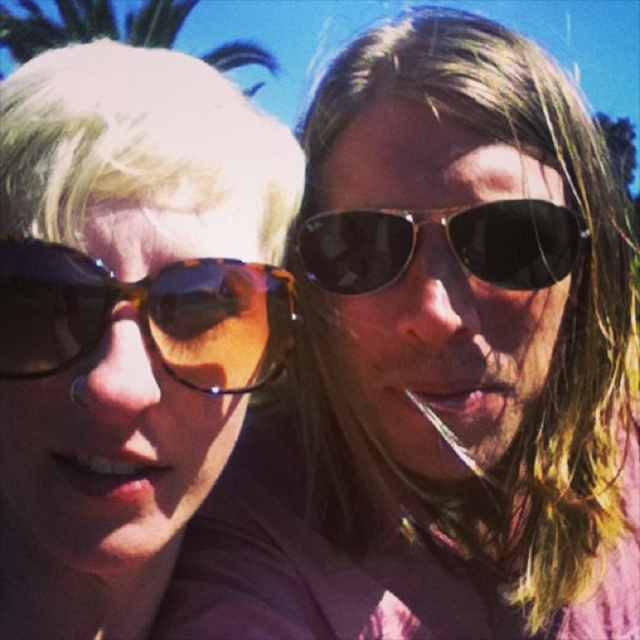
You are a photographer trying to capture a portrait of the two people in the scene. The matte tortoiseshell sunglasses at left and the green leafy palm tree at upper left are in the frame. If you want to ensure both the sunglasses and the palm tree are in focus, how far apart are they from each other?

The matte tortoiseshell sunglasses at left is 7.08 meters from the green leafy palm tree at upper left, so they are 7.08 meters apart.

You are a photographer trying to capture a clear shot of both the tortoiseshell sunglasses at left and the black reflective sunglasses at center. Since the two sunglasses are overlapping, which one should you focus on to ensure the front one is sharp?

The tortoiseshell sunglasses at left is in front of the black reflective sunglasses at center, so you should focus on the tortoiseshell sunglasses at left to ensure the front one is sharp.

You are a photographer trying to capture the matte tortoiseshell sunglasses at left in the image. Where exactly should you focus your camera to ensure they are in the center of the frame?

You should focus your camera at the coordinates point (125, 320) to center the matte tortoiseshell sunglasses at left.